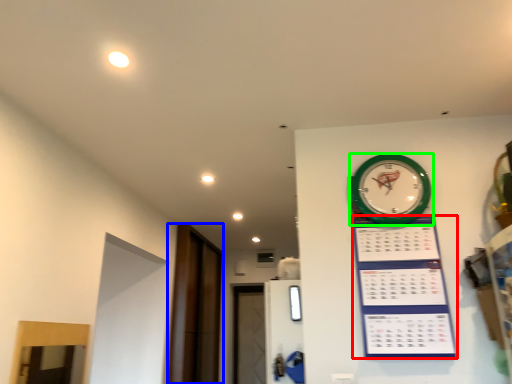
Question: Based on their relative distances, which object is farther from bulletin board (highlighted by a red box)? Choose from glass door (highlighted by a blue box) and wall clock (highlighted by a green box).

Choices:
 (A) glass door
 (B) wall clock

Answer: (A)